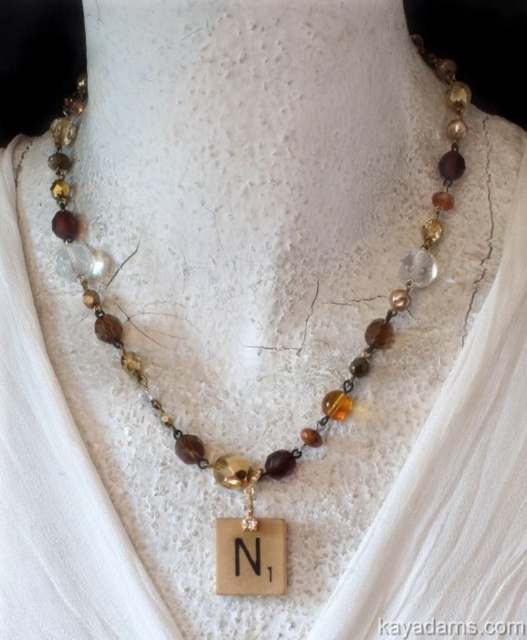
Looking at the necklace on the mannequin, which object is taller between the translucent glass beads at center and the wooden square at center?

The translucent glass beads at center are taller than the wooden square at center.

You are a jewelry designer who wants to ensure proper spacing between the translucent glass beads at center and the wooden square at center on the necklace. According to the design specifications, the minimum required distance between these two elements is 10 inches. Based on the image, is the current spacing sufficient?

The translucent glass beads at center is 9.47 inches away from wooden square at center, which is less than the required 10 inches. Therefore, the current spacing is insufficient and needs adjustment to meet the design specifications.

You are an appraiser examining the necklace. The necklace is displayed on a mannequin torso. You need to locate the translucent glass beads at center. Where exactly are they positioned in terms of coordinates?

The translucent glass beads at center are positioned at coordinates point (x=325, y=394).